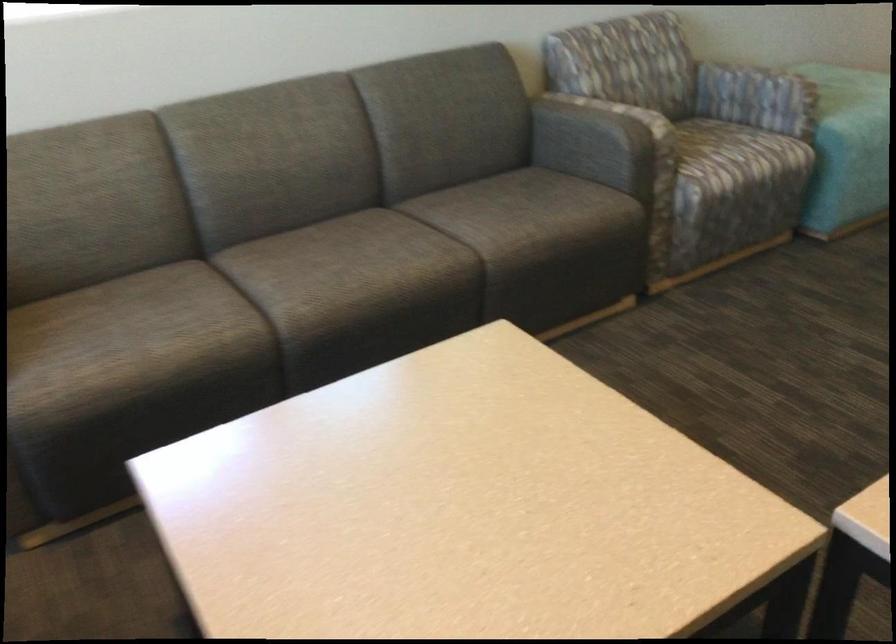
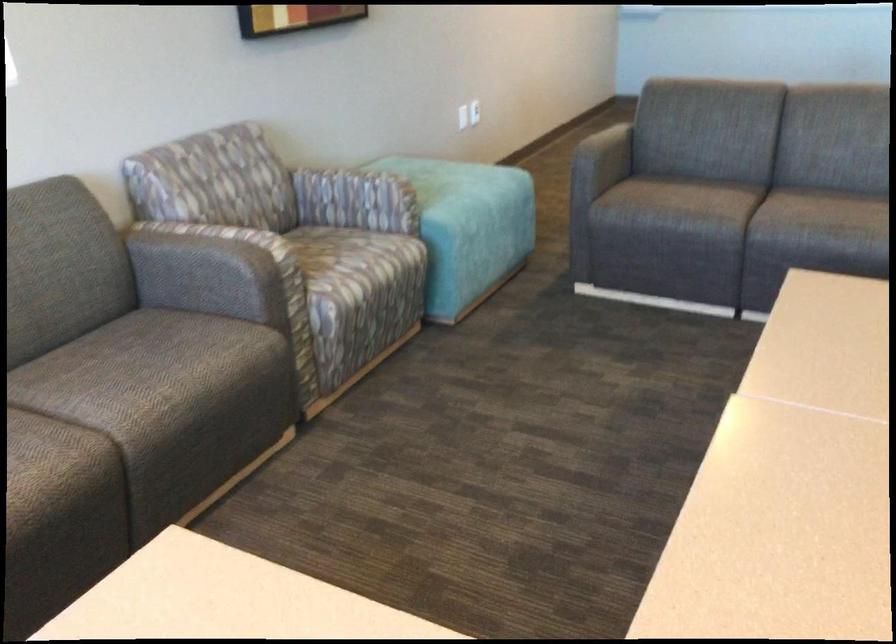
Question: The camera is either moving clockwise (left) or counter-clockwise (right) around the object. The first image is from the beginning of the video and the second image is from the end. Is the camera moving left or right when shooting the video?

Choices:
 (A) Left
 (B) Right

Answer: (A)